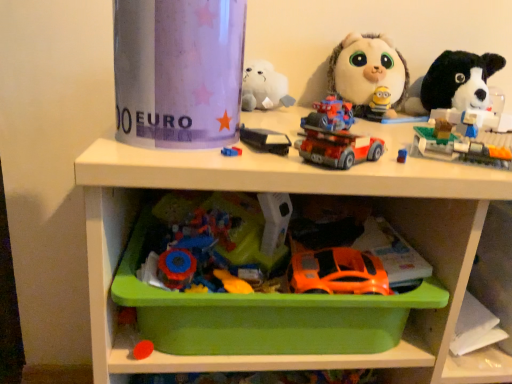
This screenshot has width=512, height=384. Find the location of `vacant space behind translucent plastic building blocks at upper right, which is the third toy from top to bottom`. vacant space behind translucent plastic building blocks at upper right, which is the third toy from top to bottom is located at coordinates (407, 129).